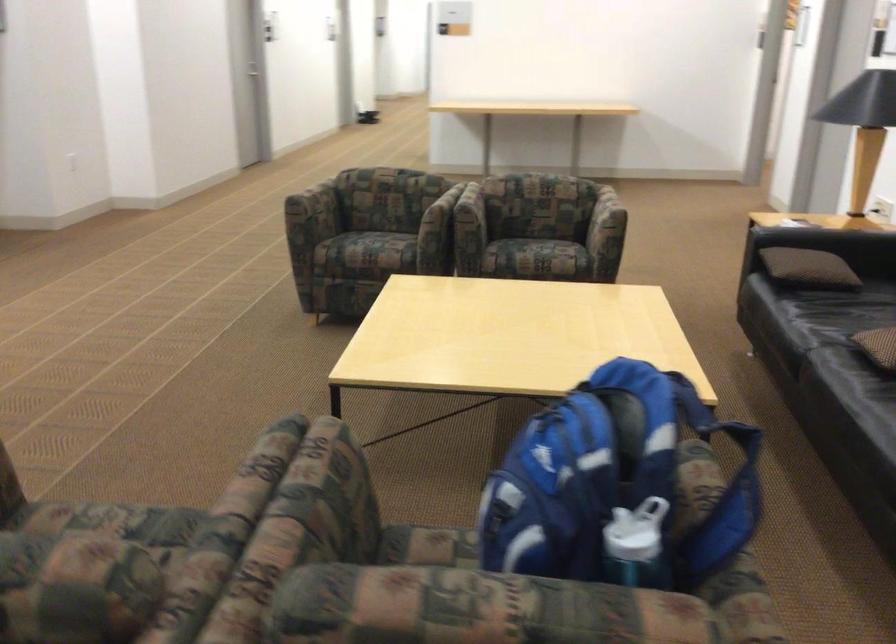
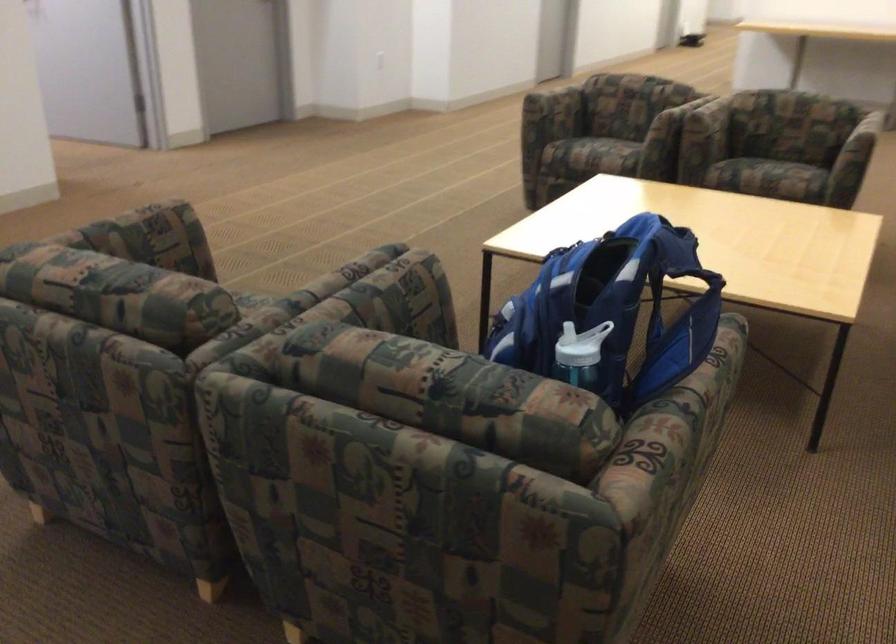
Locate, in the second image, the point that corresponds to pixel 549 263 in the first image.

(769, 178)